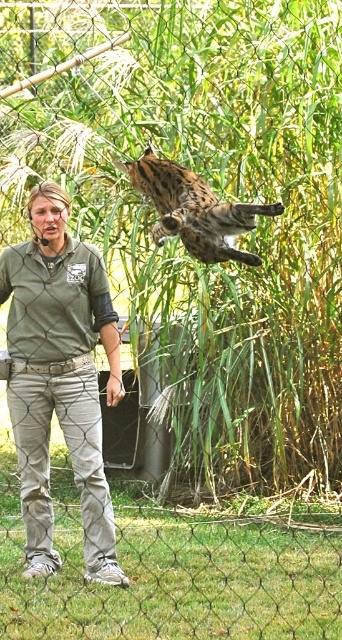
The width and height of the screenshot is (342, 640). Identify the location of gray cotton shirt at center. (59, 378).

Who is more forward, (80,371) or (214,195)?

Point (214,195)

Describe the element at coordinates (59, 378) in the screenshot. I see `gray cotton shirt at center` at that location.

Locate an element on the screen. The width and height of the screenshot is (342, 640). gray cotton shirt at center is located at coordinates (59, 378).